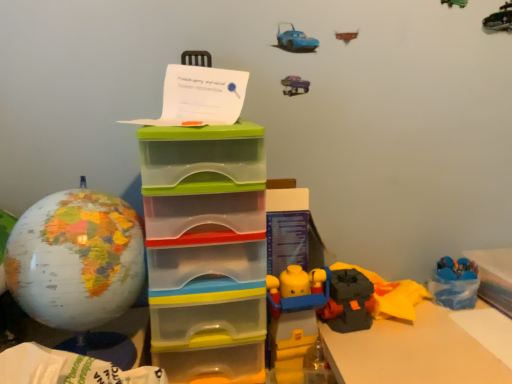
Find the location of a particular element. matte globe at left is located at coordinates (79, 268).

This screenshot has height=384, width=512. Describe the element at coordinates (206, 250) in the screenshot. I see `translucent plastic storage box at center, the second storage box when ordered from right to left` at that location.

What is the approximate height of translucent plastic storage box at center, the second storage box when ordered from right to left?

translucent plastic storage box at center, the second storage box when ordered from right to left, is 19.37 inches in height.

I want to click on matte globe at left, so click(79, 268).

Can you see translucent plastic storage box at center, arranged as the 1th storage box when viewed from the left, touching blue plastic storage box at lower right, which ranks as the 2th storage box in left-to-right order?

No, translucent plastic storage box at center, arranged as the 1th storage box when viewed from the left, is not beside blue plastic storage box at lower right, which ranks as the 2th storage box in left-to-right order.

From the picture: From the image's perspective, does translucent plastic storage box at center, arranged as the 1th storage box when viewed from the left, appear higher than blue plastic storage box at lower right, which ranks as the first storage box in right-to-left order?

Yes, from the image's perspective, translucent plastic storage box at center, arranged as the 1th storage box when viewed from the left, is over blue plastic storage box at lower right, which ranks as the first storage box in right-to-left order.

Can you tell me how much translucent plastic storage box at center, the second storage box when ordered from right to left, and blue plastic storage box at lower right, which ranks as the first storage box in right-to-left order, differ in facing direction?

There is a 5.67-degree angle between the facing directions of translucent plastic storage box at center, the second storage box when ordered from right to left, and blue plastic storage box at lower right, which ranks as the first storage box in right-to-left order.

Does translucent plastic storage box at center, arranged as the 1th storage box when viewed from the left, have a greater width compared to blue plastic storage box at lower right, which ranks as the first storage box in right-to-left order?

Yes.

Which object is positioned more to the right, matte globe at left or translucent plastic storage box at center, arranged as the 1th storage box when viewed from the left?

translucent plastic storage box at center, arranged as the 1th storage box when viewed from the left.

Considering the relative sizes of matte globe at left and translucent plastic storage box at center, arranged as the 1th storage box when viewed from the left, in the image provided, is matte globe at left wider than translucent plastic storage box at center, arranged as the 1th storage box when viewed from the left,?

In fact, matte globe at left might be narrower than translucent plastic storage box at center, arranged as the 1th storage box when viewed from the left.

Could you tell me if matte globe at left is turned towards translucent plastic storage box at center, arranged as the 1th storage box when viewed from the left?

No.

Considering the sizes of objects matte globe at left and translucent plastic storage box at center, arranged as the 1th storage box when viewed from the left, in the image provided, who is shorter, matte globe at left or translucent plastic storage box at center, arranged as the 1th storage box when viewed from the left,?

Standing shorter between the two is matte globe at left.

Is translucent plastic storage box at center, the second storage box when ordered from right to left, facing away from matte globe at left?

No, matte globe at left is not at the back of translucent plastic storage box at center, the second storage box when ordered from right to left.

From a real-world perspective, between translucent plastic storage box at center, arranged as the 1th storage box when viewed from the left, and matte globe at left, who is vertically lower?

translucent plastic storage box at center, arranged as the 1th storage box when viewed from the left.

Considering the sizes of objects translucent plastic storage box at center, arranged as the 1th storage box when viewed from the left, and matte globe at left in the image provided, who is thinner, translucent plastic storage box at center, arranged as the 1th storage box when viewed from the left, or matte globe at left?

With smaller width is matte globe at left.

From the image's perspective, would you say blue plastic storage box at lower right, which ranks as the 2th storage box in left-to-right order, is shown under translucent plastic storage box at center, the second storage box when ordered from right to left?

Correct, blue plastic storage box at lower right, which ranks as the 2th storage box in left-to-right order, appears lower than translucent plastic storage box at center, the second storage box when ordered from right to left, in the image.

Which is more to the right, blue plastic storage box at lower right, which ranks as the first storage box in right-to-left order, or translucent plastic storage box at center, arranged as the 1th storage box when viewed from the left?

Positioned to the right is blue plastic storage box at lower right, which ranks as the first storage box in right-to-left order.

Is blue plastic storage box at lower right, which ranks as the 2th storage box in left-to-right order, looking in the opposite direction of translucent plastic storage box at center, arranged as the 1th storage box when viewed from the left?

No.

Does matte globe at left turn towards blue plastic storage box at lower right, which ranks as the 2th storage box in left-to-right order?

No, matte globe at left is not oriented towards blue plastic storage box at lower right, which ranks as the 2th storage box in left-to-right order.

Which is correct: matte globe at left is inside blue plastic storage box at lower right, which ranks as the 2th storage box in left-to-right order, or outside of it?

matte globe at left is located beyond the bounds of blue plastic storage box at lower right, which ranks as the 2th storage box in left-to-right order.

How different are the orientations of matte globe at left and blue plastic storage box at lower right, which ranks as the 2th storage box in left-to-right order, in degrees?

The angular difference between matte globe at left and blue plastic storage box at lower right, which ranks as the 2th storage box in left-to-right order, is 1.65 degrees.

Measure the distance between matte globe at left and blue plastic storage box at lower right, which ranks as the first storage box in right-to-left order.

The distance of matte globe at left from blue plastic storage box at lower right, which ranks as the first storage box in right-to-left order, is 75.30 centimeters.

Considering the sizes of blue plastic storage box at lower right, which ranks as the 2th storage box in left-to-right order, and matte globe at left in the image, is blue plastic storage box at lower right, which ranks as the 2th storage box in left-to-right order, wider or thinner than matte globe at left?

Clearly, blue plastic storage box at lower right, which ranks as the 2th storage box in left-to-right order, has less width compared to matte globe at left.

Can you confirm if blue plastic storage box at lower right, which ranks as the 2th storage box in left-to-right order, is bigger than matte globe at left?

Incorrect, blue plastic storage box at lower right, which ranks as the 2th storage box in left-to-right order, is not larger than matte globe at left.

Would you say blue plastic storage box at lower right, which ranks as the first storage box in right-to-left order, is outside matte globe at left?

Absolutely, blue plastic storage box at lower right, which ranks as the first storage box in right-to-left order, is external to matte globe at left.

Is blue plastic storage box at lower right, which ranks as the first storage box in right-to-left order, beside matte globe at left?

No, blue plastic storage box at lower right, which ranks as the first storage box in right-to-left order, is not making contact with matte globe at left.

Image resolution: width=512 pixels, height=384 pixels. Find the location of `storage box to the left of blue plastic storage box at lower right, which ranks as the first storage box in right-to-left order`. storage box to the left of blue plastic storage box at lower right, which ranks as the first storage box in right-to-left order is located at coordinates (206, 250).

From a real-world perspective, count 1st storage boxs downward from the matte globe at left and point to it. Please provide its 2D coordinates.

[(206, 250)]

In the scene shown: Considering their positions, is matte globe at left positioned further to blue plastic storage box at lower right, which ranks as the 2th storage box in left-to-right order, than translucent plastic storage box at center, arranged as the 1th storage box when viewed from the left?

Among the two, matte globe at left is located further to blue plastic storage box at lower right, which ranks as the 2th storage box in left-to-right order.

Which object lies nearer to the anchor point translucent plastic storage box at center, arranged as the 1th storage box when viewed from the left, matte globe at left or blue plastic storage box at lower right, which ranks as the first storage box in right-to-left order?

Based on the image, matte globe at left appears to be nearer to translucent plastic storage box at center, arranged as the 1th storage box when viewed from the left.

Based on their spatial positions, is translucent plastic storage box at center, arranged as the 1th storage box when viewed from the left, or blue plastic storage box at lower right, which ranks as the first storage box in right-to-left order, further from matte globe at left?

Among the two, blue plastic storage box at lower right, which ranks as the first storage box in right-to-left order, is located further to matte globe at left.

Which object lies nearer to the anchor point matte globe at left, blue plastic storage box at lower right, which ranks as the first storage box in right-to-left order, or translucent plastic storage box at center, arranged as the 1th storage box when viewed from the left?

The object closer to matte globe at left is translucent plastic storage box at center, arranged as the 1th storage box when viewed from the left.

Looking at the image, which one is located further to translucent plastic storage box at center, the second storage box when ordered from right to left, blue plastic storage box at lower right, which ranks as the first storage box in right-to-left order, or matte globe at left?

Based on the image, blue plastic storage box at lower right, which ranks as the first storage box in right-to-left order, appears to be further to translucent plastic storage box at center, the second storage box when ordered from right to left.

From the image, which object appears to be nearer to blue plastic storage box at lower right, which ranks as the 2th storage box in left-to-right order, translucent plastic storage box at center, arranged as the 1th storage box when viewed from the left, or matte globe at left?

The object closer to blue plastic storage box at lower right, which ranks as the 2th storage box in left-to-right order, is translucent plastic storage box at center, arranged as the 1th storage box when viewed from the left.

You are a GUI agent. You are given a task and a screenshot of the screen. Output one action in this format:
    pyautogui.click(x=<x>, y=<y>)
    Task: Click on the storage box between matte globe at left and blue plastic storage box at lower right, which ranks as the first storage box in right-to-left order, from left to right
    
    Given the screenshot: What is the action you would take?
    pyautogui.click(x=206, y=250)